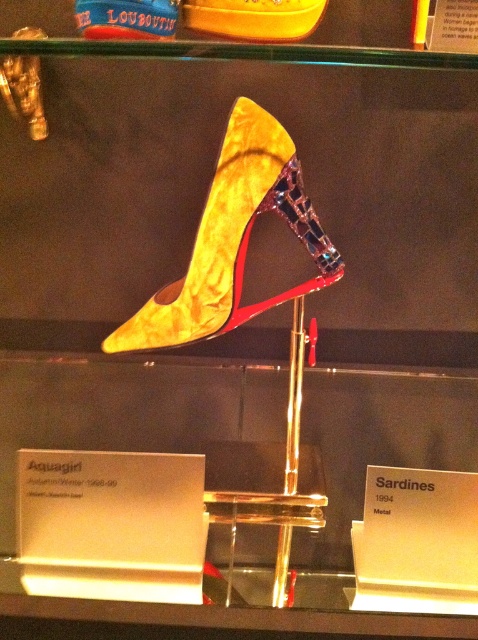
You are an interior designer arranging a display case. You have two shoes to place in the case. The velvet gold shoe at center and the shiny gold shoe at upper center. According to the design principles of symmetry, which shoe should be placed to the left of the other?

The velvet gold shoe at center should be placed to the left of the shiny gold shoe at upper center because the velvet gold shoe at center is positioned on the left side of shiny gold shoe at upper center.

In the scene shown: You are an interior designer planning to place a small decorative item on the display case. The item you have is 10 cm wide. You see the velvet gold shoe at center and the shiny gold shoe at upper center. Which shoe can accommodate the item without it overlapping?

The velvet gold shoe at center is bigger than the shiny gold shoe at upper center, so the velvet gold shoe at center can accommodate the item without it overlapping.